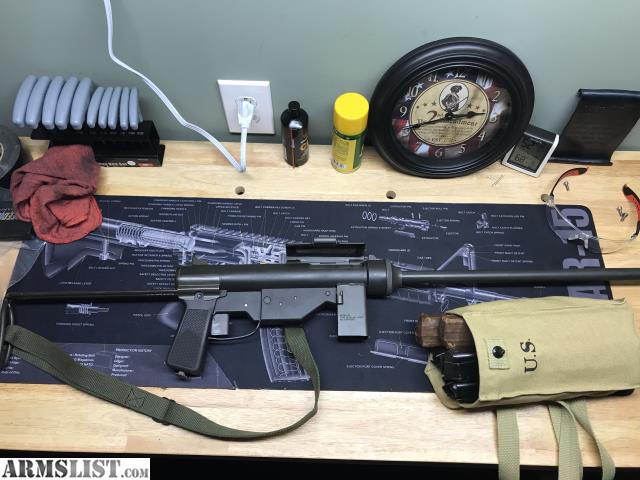
Locate an element on the screen. The width and height of the screenshot is (640, 480). plug is located at coordinates (246, 119).